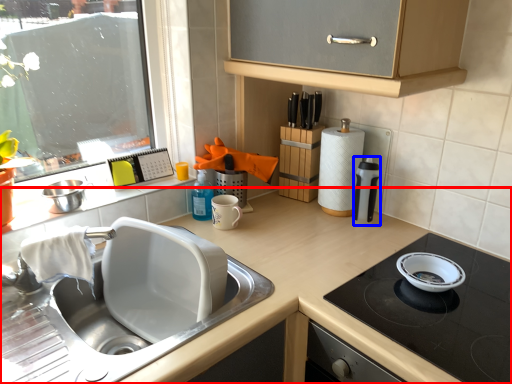
Question: Which object is closer to the camera taking this photo, countertop (highlighted by a red box) or kitchen appliance (highlighted by a blue box)?

Choices:
 (A) countertop
 (B) kitchen appliance

Answer: (A)